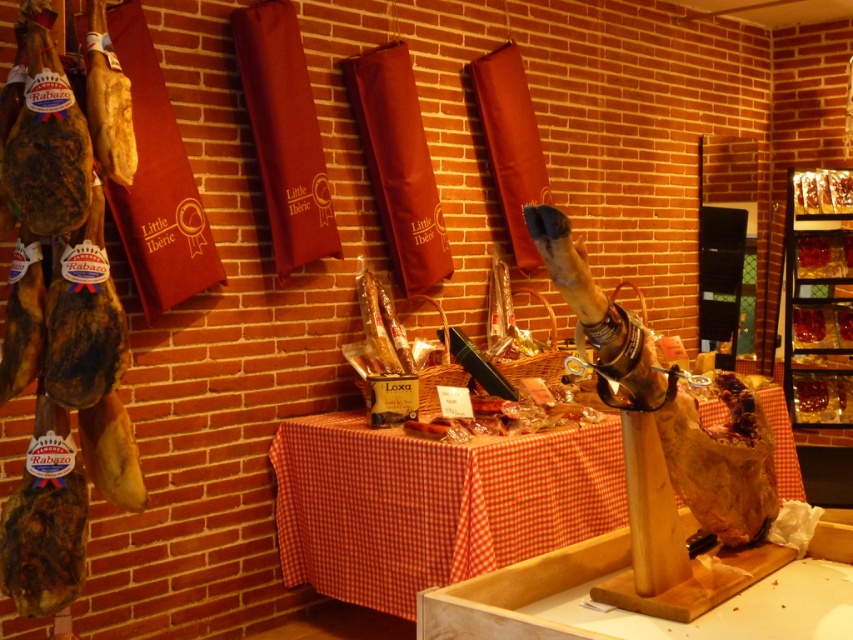
You are a customer in the deli and want to grab a jar of olives from the translucent glass shelves at upper right. You are standing 1.2 meters tall. Can you reach the shelves?

The translucent glass shelves at upper right is 4.85 meters away from camera, so it is too far for a 1.2 meters tall customer to reach.